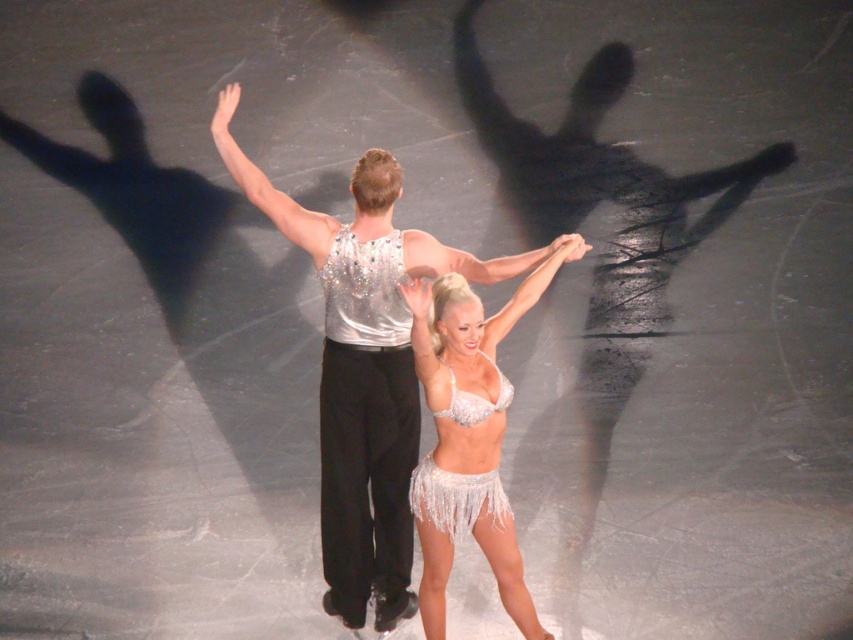
You are a photographer at the edge of the ice rink. You want to capture a photo of the sequined white skirt at center and the white sequined skirt at center. Which one will appear closer to the camera in the photo?

The sequined white skirt at center will appear closer to the camera because it is in front of the white sequined skirt at center.

You are designing a costume for a skating performance and need to ensure that the silver sparkly tank top at center and the sequined white skirt at center fit together. Based on their sizes, which part of the costume has a wider width?

The silver sparkly tank top at center has a larger width than the sequined white skirt at center according to the description.

You are a photographer at the back of the rink taking pictures of the two skaters. You notice the sparkly silver bikini at center and the white sequined skirt at center. Which one will appear larger in your photo?

The sparkly silver bikini at center will appear larger in the photo because it is closer to the viewer than the white sequined skirt at center.